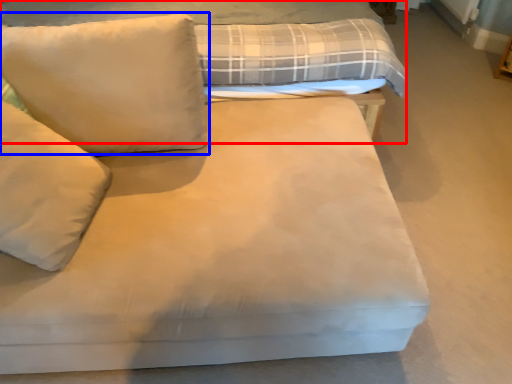
Question: Among these objects, which one is farthest to the camera, bed (highlighted by a red box) or pillow (highlighted by a blue box)?

Choices:
 (A) bed
 (B) pillow

Answer: (A)